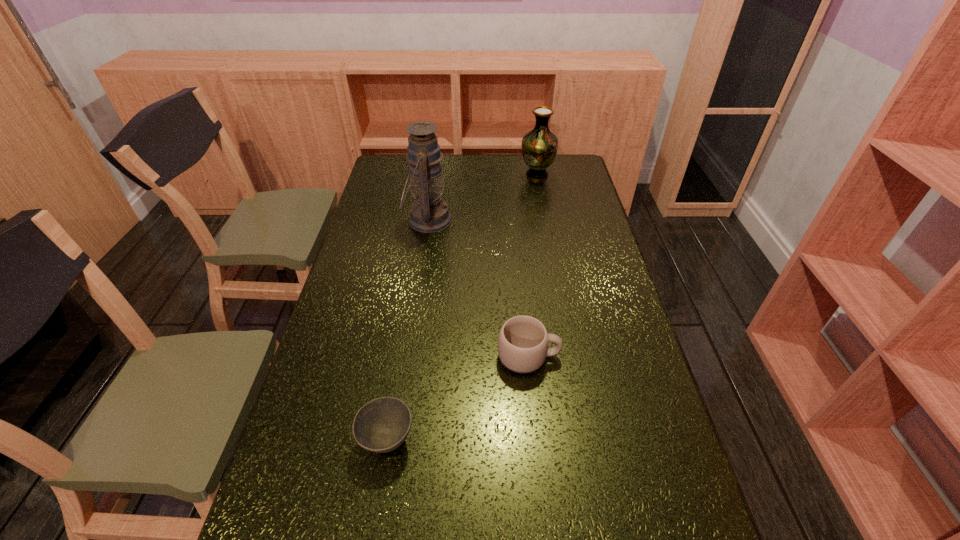
In order to click on the tallest object in this screenshot , I will do `click(429, 213)`.

The height and width of the screenshot is (540, 960). I want to click on the second farthest object, so click(429, 213).

This screenshot has height=540, width=960. What are the coordinates of `the farthest object` in the screenshot? It's located at (539, 147).

Locate an element on the screen. The height and width of the screenshot is (540, 960). the second tallest object is located at coordinates (539, 147).

I want to click on the second nearest object, so click(523, 340).

Find the location of a particular element. The height and width of the screenshot is (540, 960). mug is located at coordinates (523, 340).

Where is `the nearest object`? This screenshot has height=540, width=960. the nearest object is located at coordinates (382, 425).

Identify the location of the shortest object. (382, 425).

You are a GUI agent. You are given a task and a screenshot of the screen. Output one action in this format:
    pyautogui.click(x=<x>, y=<y>)
    Task: Click on the vacant position located 0.080m on the back of the oil lamp
    
    Given the screenshot: What is the action you would take?
    pyautogui.click(x=432, y=191)

Find the location of `vacant region located on the back of the farthest object`. vacant region located on the back of the farthest object is located at coordinates (533, 154).